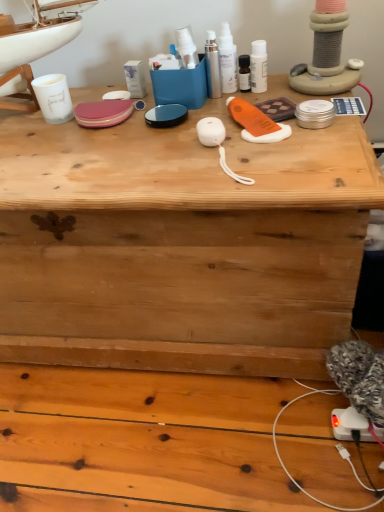
Image resolution: width=384 pixels, height=512 pixels. I want to click on vacant space in front of white glossy lotion at upper center, which is counted as the 3th toiletry, starting from the left, so click(278, 128).